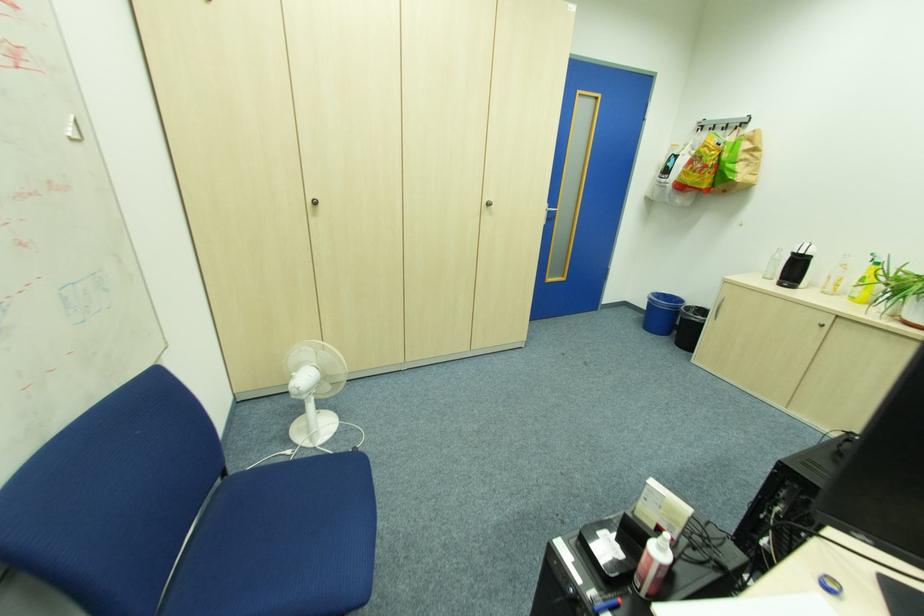
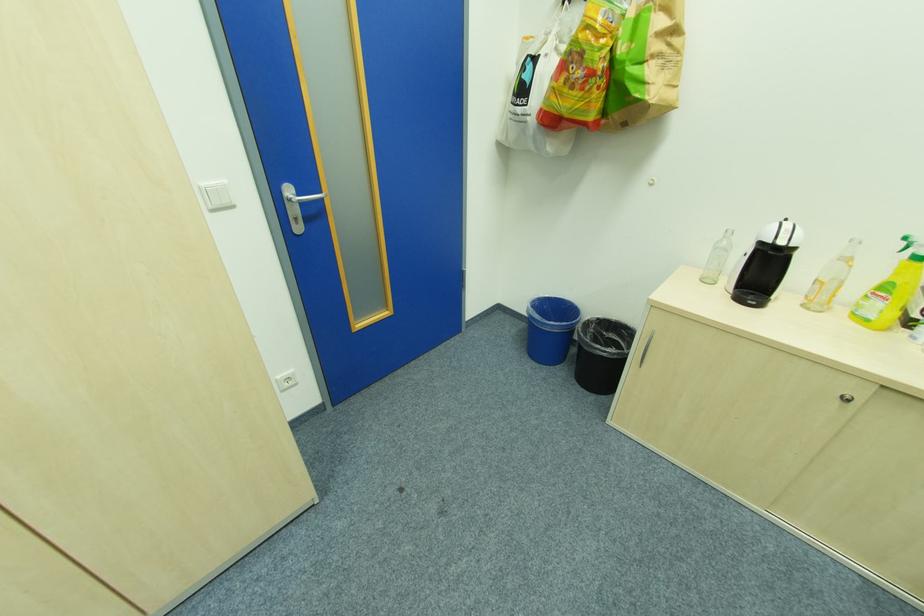
In the second image, find the point that corresponds to (x=829, y=323) in the first image.

(852, 395)